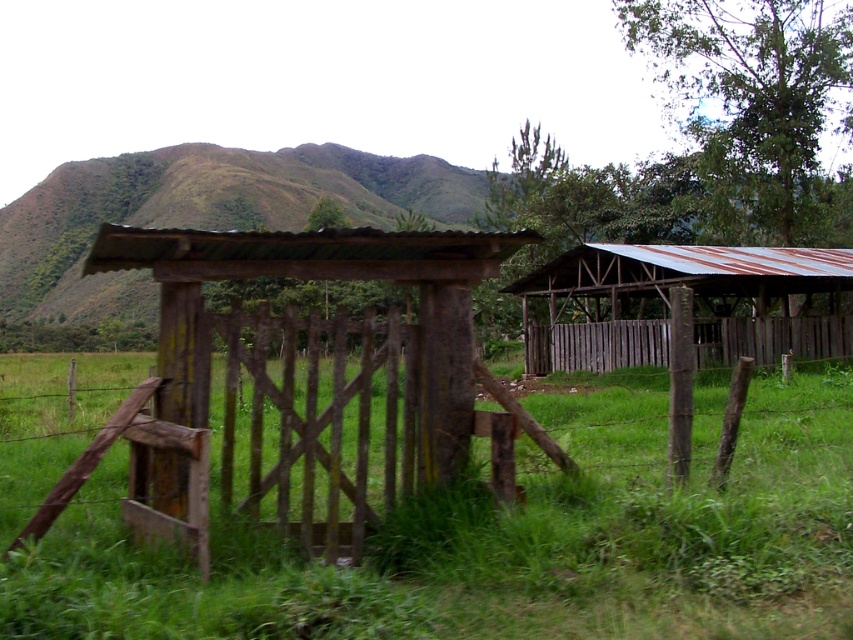
How distant is green grassy at center from weathered wood gate at center?

green grassy at center is 4.66 meters from weathered wood gate at center.

Looking at this image, between green grassy at center and weathered wood gate at center, which one has more height?

With more height is weathered wood gate at center.

This screenshot has width=853, height=640. I want to click on green grassy at center, so click(x=509, y=540).

Does green grassy at center have a larger size compared to rusty corrugated metal barn at right?

Actually, green grassy at center might be smaller than rusty corrugated metal barn at right.

Does point (171, 563) lie behind point (613, 289)?

That is False.

Who is more forward, (236, 588) or (804, 276)?

Point (236, 588) is in front.

Where is `green grassy at center`? green grassy at center is located at coordinates (509, 540).

Does point (83, 586) lie in front of point (669, 324)?

Yes, point (83, 586) is in front of point (669, 324).

Between point (70, 435) and point (608, 337), which one is positioned in front?

Positioned in front is point (70, 435).

You are a GUI agent. You are given a task and a screenshot of the screen. Output one action in this format:
    pyautogui.click(x=<x>, y=<y>)
    Task: Click on the green grassy at center
    This screenshot has width=853, height=640.
    Given the screenshot: What is the action you would take?
    pyautogui.click(x=509, y=540)